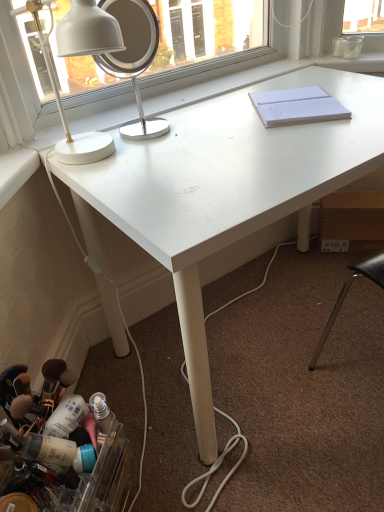
This screenshot has width=384, height=512. Find the location of `free area in between white glossy desk lamp at upper left and white metallic mirror at upper left`. free area in between white glossy desk lamp at upper left and white metallic mirror at upper left is located at coordinates (159, 144).